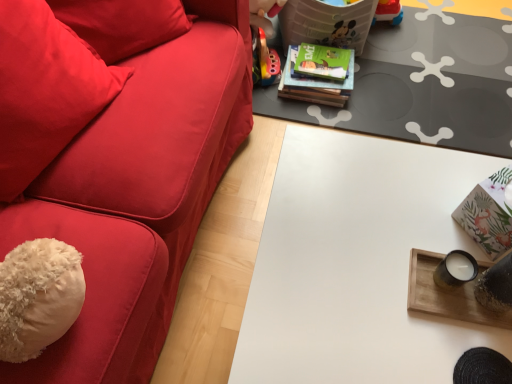
Question: Considering the relative sizes of green matte book at upper center and white matte table at center, the 3th table when ordered from top to bottom, in the image provided, is green matte book at upper center shorter than white matte table at center, the 3th table when ordered from top to bottom,?

Choices:
 (A) no
 (B) yes

Answer: (B)

Question: Is the depth of green matte book at upper center greater than that of white matte table at center, which ranks as the first table in bottom-to-top order?

Choices:
 (A) yes
 (B) no

Answer: (A)

Question: Is white matte table at center, which ranks as the 3th table in back-to-front order, inside green matte book at upper center?

Choices:
 (A) no
 (B) yes

Answer: (A)

Question: From a real-world perspective, is green matte book at upper center physically below white matte table at center, which ranks as the first table in bottom-to-top order?

Choices:
 (A) no
 (B) yes

Answer: (B)

Question: Is green matte book at upper center to the right of white matte table at center, which ranks as the 3th table in back-to-front order, from the viewer's perspective?

Choices:
 (A) no
 (B) yes

Answer: (A)

Question: Considering the positions of matte gray table at center, the 1th table from the back, and green matte book at upper center in the image, is matte gray table at center, the 1th table from the back, bigger or smaller than green matte book at upper center?

Choices:
 (A) small
 (B) big

Answer: (B)

Question: Considering their positions, is matte gray table at center, the 1th table from the back, located in front of or behind green matte book at upper center?

Choices:
 (A) front
 (B) behind

Answer: (A)

Question: From the image's perspective, is matte gray table at center, the 1th table from the back, located above or below green matte book at upper center?

Choices:
 (A) below
 (B) above

Answer: (B)

Question: From a real-world perspective, is matte gray table at center, which is the 3th table from front to back, above or below green matte book at upper center?

Choices:
 (A) above
 (B) below

Answer: (B)

Question: From their relative heights in the image, would you say velvety red throw pillow at left is taller or shorter than matte gray table at center, which is the 3th table from front to back?

Choices:
 (A) short
 (B) tall

Answer: (B)

Question: From a real-world perspective, is velvety red throw pillow at left positioned above or below matte gray table at center, the third table positioned from the bottom?

Choices:
 (A) below
 (B) above

Answer: (B)

Question: Looking at their shapes, would you say velvety red throw pillow at left is wider or thinner than matte gray table at center, the third table positioned from the bottom?

Choices:
 (A) wide
 (B) thin

Answer: (B)

Question: From the image's perspective, is velvety red throw pillow at left above or below matte gray table at center, which is the 3th table from front to back?

Choices:
 (A) above
 (B) below

Answer: (B)

Question: In terms of size, does white matte table at center, which ranks as the 3th table in back-to-front order, appear bigger or smaller than green matte book at upper center?

Choices:
 (A) big
 (B) small

Answer: (A)

Question: From their relative heights in the image, would you say white matte table at center, the first table when ordered from front to back, is taller or shorter than green matte book at upper center?

Choices:
 (A) short
 (B) tall

Answer: (B)